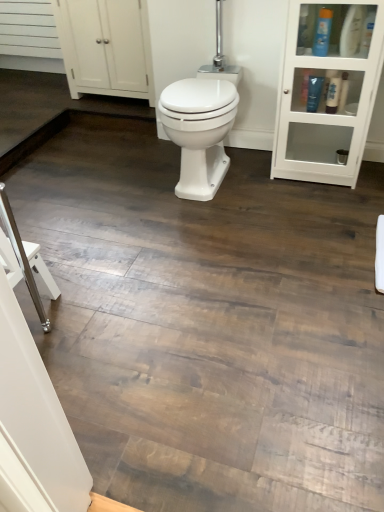
I want to click on vacant area to the right of white glossy bidet at center, so click(x=278, y=186).